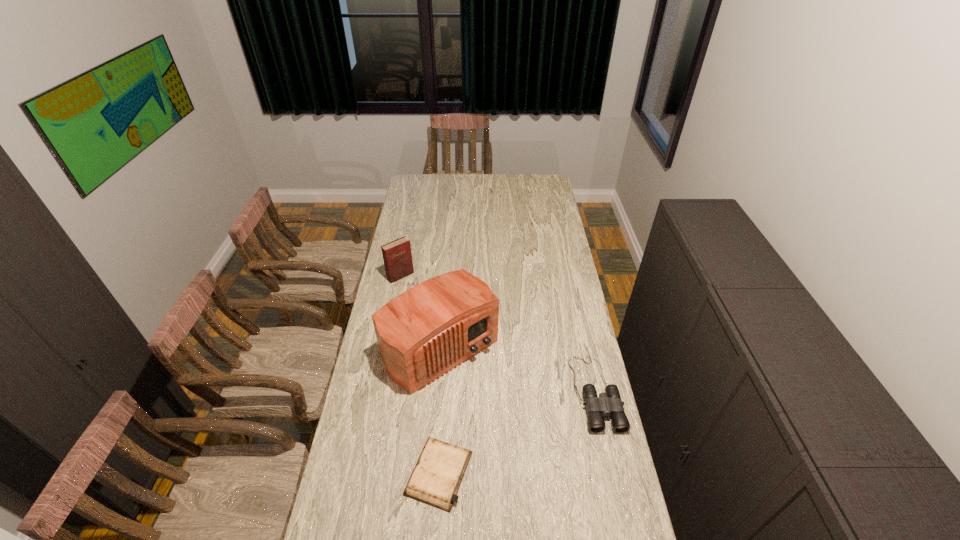
Where is `vacant point located between the farther diary and the third tallest object`? The height and width of the screenshot is (540, 960). vacant point located between the farther diary and the third tallest object is located at coordinates (498, 334).

What are the coordinates of `free area in between the radio receiver and the nearest object` in the screenshot? It's located at (440, 411).

Select which object is the second closest to the shorter diary. Please provide its 2D coordinates. Your answer should be formatted as a tuple, i.e. [(x, y)], where the tuple contains the x and y coordinates of a point satisfying the conditions above.

[(609, 403)]

Find the location of a particular element. This screenshot has width=960, height=540. object that stands as the third closest to the binoculars is located at coordinates (397, 256).

Locate an element on the screen. The image size is (960, 540). free spot that satisfies the following two spatial constraints: 1. on the front side of the radio receiver; 2. on the left side of the nearest object is located at coordinates (430, 473).